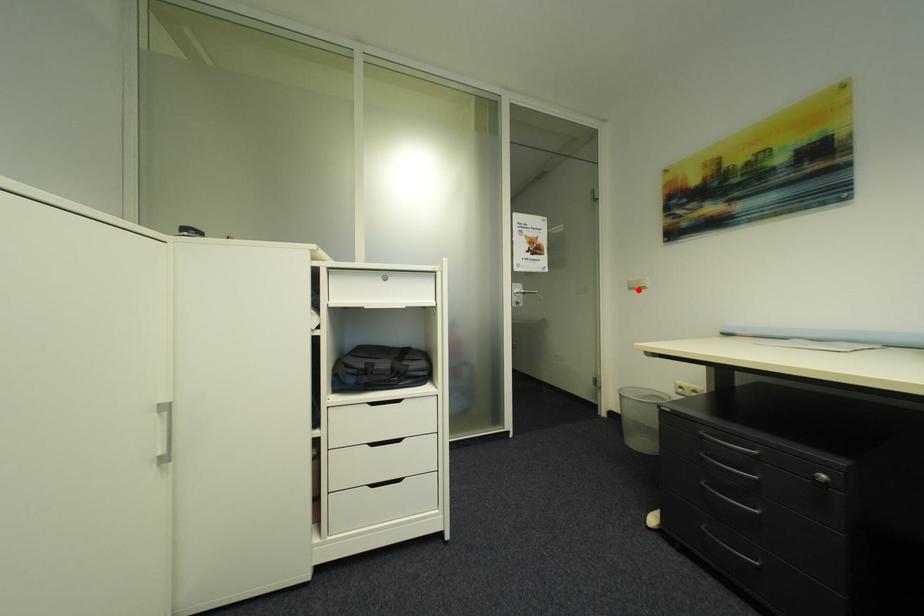
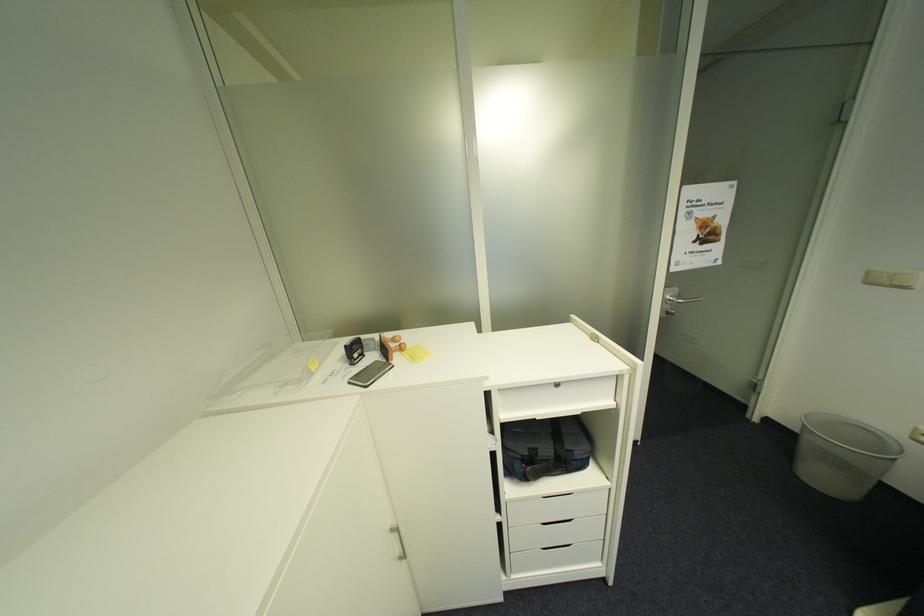
Find the pixel in the second image that matches the highlighted location in the first image.

(876, 284)